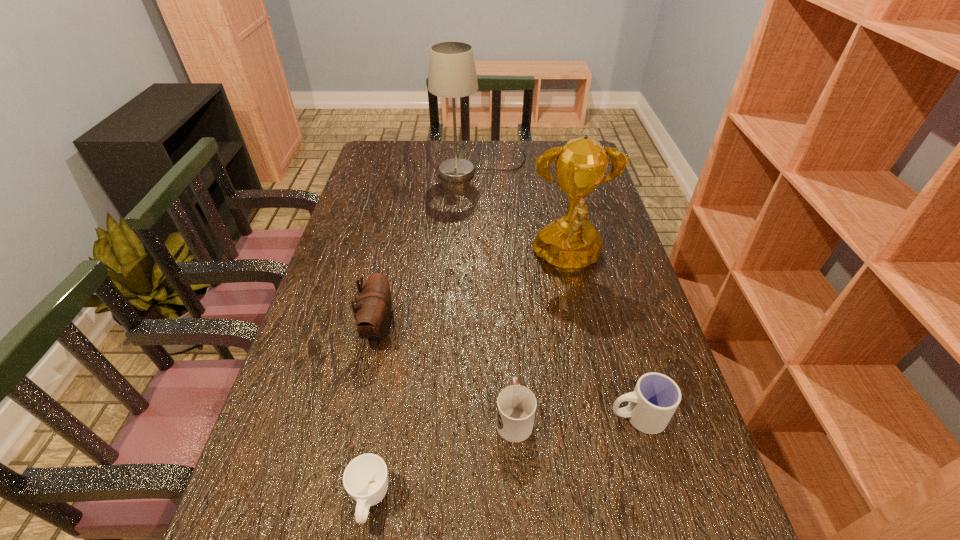
In order to click on object at the left edge in this screenshot , I will do `click(373, 312)`.

Find the location of `award present at the right edge`. award present at the right edge is located at coordinates (571, 243).

At what (x,y) coordinates should I click in order to perform the action: click on cup at the right edge. Please return your answer as a coordinate pair (x, y). Looking at the image, I should click on (655, 398).

You are a GUI agent. You are given a task and a screenshot of the screen. Output one action in this format:
    pyautogui.click(x=<x>, y=<y>)
    Task: Click on the free region at the far edge of the desktop
    The image size is (960, 540).
    Given the screenshot: What is the action you would take?
    pyautogui.click(x=516, y=167)

This screenshot has width=960, height=540. In the image, there is a desktop. In order to click on vacant space at the left edge in this screenshot , I will do `click(311, 475)`.

Where is `vacant space at the right edge`? vacant space at the right edge is located at coordinates (600, 191).

The image size is (960, 540). Identify the location of free spot between the nearest object and the rightmost cup. (504, 458).

You are a GUI agent. You are given a task and a screenshot of the screen. Output one action in this format:
    pyautogui.click(x=<x>, y=<y>)
    Task: Click on the free space that is in between the shortest object and the tallest object
    
    Given the screenshot: What is the action you would take?
    pyautogui.click(x=426, y=335)

Identify the location of free space between the third tallest object and the second farthest object. Image resolution: width=960 pixels, height=540 pixels. (473, 294).

This screenshot has width=960, height=540. Find the location of `vacant space in between the second cup from right to left and the pouch`. vacant space in between the second cup from right to left and the pouch is located at coordinates (446, 373).